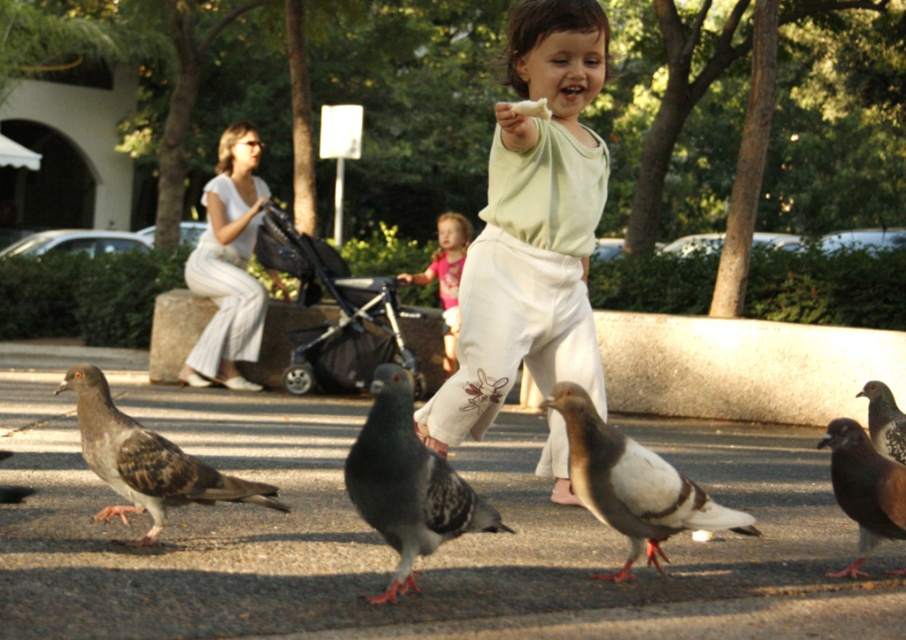
Question: Which point appears farthest from the camera in this image?

Choices:
 (A) (116, 513)
 (B) (447, 220)
 (C) (392, 492)

Answer: (B)

Question: Does light green cotton shirt at center have a smaller size compared to gray speckled pigeon at center?

Choices:
 (A) no
 (B) yes

Answer: (A)

Question: Which of the following is the closest to the observer?

Choices:
 (A) (439, 224)
 (B) (369, 493)

Answer: (B)

Question: Based on their relative distances, which object is nearer to the speckled feather pigeon at center?

Choices:
 (A) speckled feathered pigeon at center
 (B) black fabric stroller at center
 (C) white cotton pants at left

Answer: (A)

Question: Can you confirm if gray speckled pigeon at center is bigger than speckled feather pigeon at center?

Choices:
 (A) no
 (B) yes

Answer: (A)

Question: Does black fabric stroller at center have a larger size compared to brown speckled feather at lower right?

Choices:
 (A) yes
 (B) no

Answer: (A)